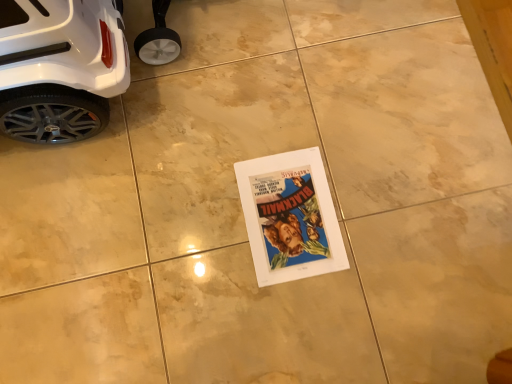
Where is `vacant area on the back side of vibrant paper movie poster at center`? vacant area on the back side of vibrant paper movie poster at center is located at coordinates (285, 117).